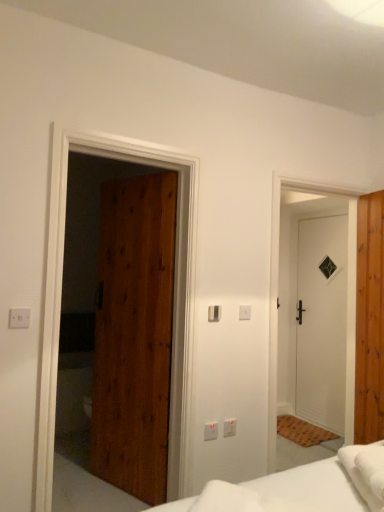
Question: Is metallic silver light switch at lower center, arranged as the third light switch when viewed from the back, thinner than white plastic light switch at center, the second light switch positioned from the bottom?

Choices:
 (A) yes
 (B) no

Answer: (A)

Question: Is metallic silver light switch at lower center, arranged as the 1th light switch when viewed from the left, to the left of white plastic light switch at center, placed as the second light switch when sorted from top to bottom, from the viewer's perspective?

Choices:
 (A) no
 (B) yes

Answer: (B)

Question: From a real-world perspective, does metallic silver light switch at lower center, the first light switch when ordered from front to back, sit lower than white plastic light switch at center, placed as the second light switch when sorted from top to bottom?

Choices:
 (A) no
 (B) yes

Answer: (B)

Question: Is metallic silver light switch at lower center, which is the third light switch in right-to-left order, oriented towards white plastic light switch at center, which is the 1th light switch from right to left?

Choices:
 (A) no
 (B) yes

Answer: (A)

Question: Is metallic silver light switch at lower center, which is the third light switch in right-to-left order, further to the viewer compared to white plastic light switch at center, the third light switch viewed from the front?

Choices:
 (A) yes
 (B) no

Answer: (B)

Question: Is white matte door at right, the 2th door when ordered from left to right, taller or shorter than wooden door at left, which is the 1th door from left to right?

Choices:
 (A) tall
 (B) short

Answer: (B)

Question: Is white matte door at right, the 1th door when ordered from back to front, in front of or behind wooden door at left, the third door in the back-to-front sequence, in the image?

Choices:
 (A) behind
 (B) front

Answer: (A)

Question: From a real-world perspective, relative to wooden door at left, which is the 1th door from left to right, is white matte door at right, the 2th door when ordered from left to right, vertically above or below?

Choices:
 (A) above
 (B) below

Answer: (B)

Question: Is white matte door at right, which is counted as the second door, starting from the right, bigger or smaller than wooden door at left, which ranks as the 3th door in right-to-left order?

Choices:
 (A) big
 (B) small

Answer: (B)

Question: Is point (336, 372) positioned closer to the camera than point (157, 510)?

Choices:
 (A) farther
 (B) closer

Answer: (A)

Question: Looking at their shapes, would you say white matte door at right, which is counted as the second door, starting from the right, is wider or thinner than white soft bed at lower center?

Choices:
 (A) thin
 (B) wide

Answer: (A)

Question: From a real-world perspective, is white matte door at right, the 2th door when ordered from left to right, above or below white soft bed at lower center?

Choices:
 (A) above
 (B) below

Answer: (A)

Question: Looking at the image, does white matte door at right, which is counted as the second door, starting from the right, seem bigger or smaller compared to white soft bed at lower center?

Choices:
 (A) big
 (B) small

Answer: (A)

Question: Is white soft bed at lower center bigger or smaller than white plastic electric outlet at center, the 2th electric outlet from the front?

Choices:
 (A) small
 (B) big

Answer: (B)

Question: From the image's perspective, is white soft bed at lower center above or below white plastic electric outlet at center, the first electric outlet ordered from the bottom?

Choices:
 (A) above
 (B) below

Answer: (A)